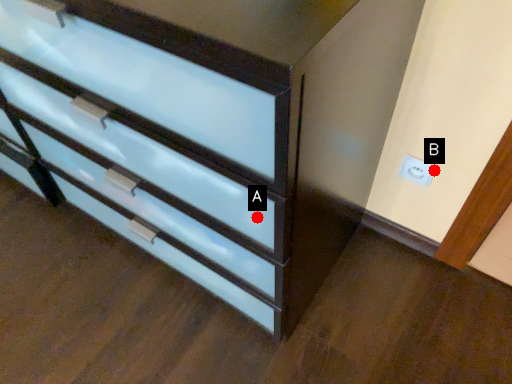
Question: Two points are circled on the image, labeled by A and B beside each circle. Which point appears farthest from the camera in this image?

Choices:
 (A) A is further
 (B) B is further

Answer: (B)